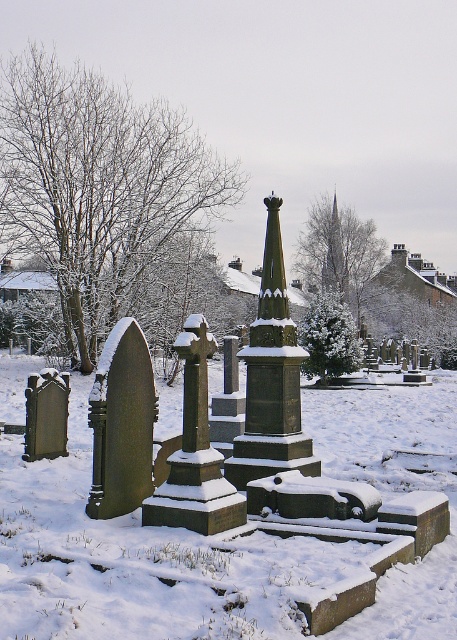
Find the location of a particular element. white frosty snow at center is located at coordinates (138, 561).

Does point (442, 420) come closer to viewer compared to point (328, 273)?

Yes, it is in front of point (328, 273).

The height and width of the screenshot is (640, 457). What do you see at coordinates (138, 561) in the screenshot? I see `white frosty snow at center` at bounding box center [138, 561].

Image resolution: width=457 pixels, height=640 pixels. Identify the location of white frosty snow at center. (138, 561).